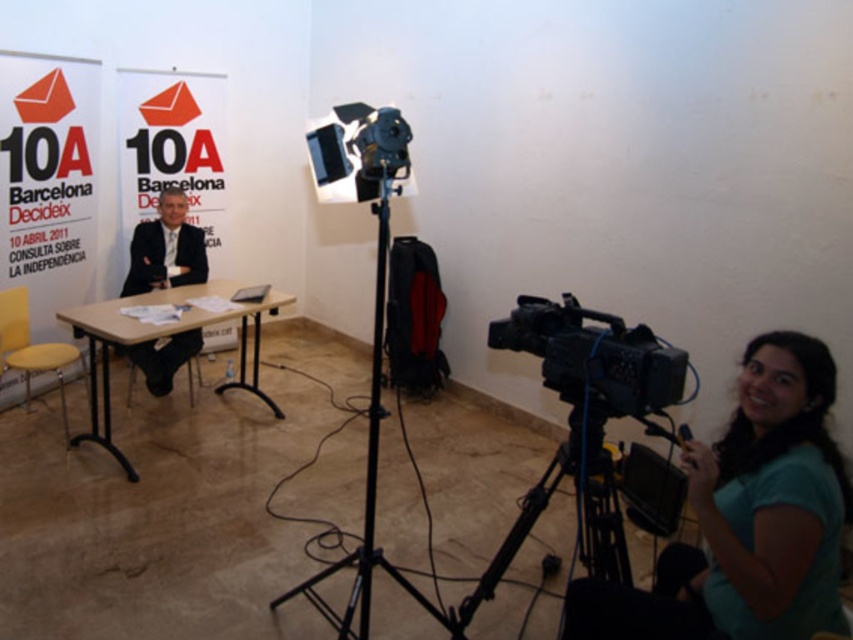
Is black plastic tripod at lower right taller than matte black suit at center?

Indeed, black plastic tripod at lower right has a greater height compared to matte black suit at center.

Does point (604, 573) come in front of point (172, 189)?

Yes.

Does point (596, 538) come in front of point (149, 241)?

That is True.

The image size is (853, 640). I want to click on black plastic tripod at lower right, so click(x=583, y=512).

From the picture: Between black metal tripod at center and matte black suit at center, which one has more height?

Standing taller between the two is black metal tripod at center.

Measure the distance from black metal tripod at center to matte black suit at center.

black metal tripod at center is 2.05 meters from matte black suit at center.

Image resolution: width=853 pixels, height=640 pixels. What do you see at coordinates (368, 477) in the screenshot?
I see `black metal tripod at center` at bounding box center [368, 477].

What are the coordinates of `black metal tripod at center` in the screenshot? It's located at (368, 477).

Can you confirm if black metal tripod at center is thinner than yellow matte stool at lower left?

No.

Can you confirm if black metal tripod at center is positioned above yellow matte stool at lower left?

Correct, black metal tripod at center is located above yellow matte stool at lower left.

Image resolution: width=853 pixels, height=640 pixels. Find the location of `black metal tripod at center`. black metal tripod at center is located at coordinates (368, 477).